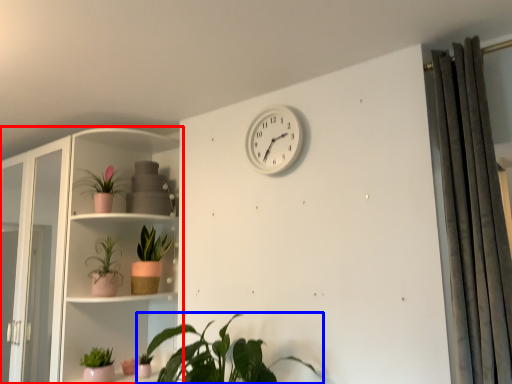
Question: Which of the following is the farthest to the observer, shelf (highlighted by a red box) or houseplant (highlighted by a blue box)?

Choices:
 (A) shelf
 (B) houseplant

Answer: (A)